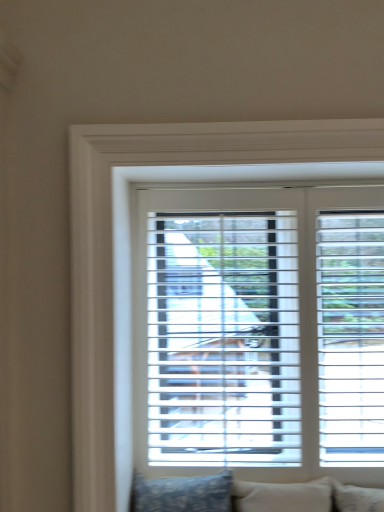
Question: Can you confirm if white plastic blinds at center is bigger than beige fabric pillow at lower center, acting as the second pillow starting from the left?

Choices:
 (A) no
 (B) yes

Answer: (B)

Question: Is beige fabric pillow at lower center, acting as the second pillow starting from the left, completely or partially inside white plastic blinds at center?

Choices:
 (A) yes
 (B) no

Answer: (B)

Question: Is white plastic blinds at center looking in the opposite direction of beige fabric pillow at lower center, which is the 1th pillow from right to left?

Choices:
 (A) yes
 (B) no

Answer: (B)

Question: Is white plastic blinds at center thinner than beige fabric pillow at lower center, which is the 1th pillow from right to left?

Choices:
 (A) no
 (B) yes

Answer: (B)

Question: From a real-world perspective, is white plastic blinds at center physically above beige fabric pillow at lower center, which is the 1th pillow from right to left?

Choices:
 (A) no
 (B) yes

Answer: (B)

Question: In the image, is white plastic blinds at center positioned in front of or behind beige fabric pillow at lower center, acting as the second pillow starting from the left?

Choices:
 (A) behind
 (B) front

Answer: (A)

Question: Considering the positions of white plastic blinds at center and beige fabric pillow at lower center, which is the 1th pillow from right to left, in the image, is white plastic blinds at center wider or thinner than beige fabric pillow at lower center, which is the 1th pillow from right to left,?

Choices:
 (A) wide
 (B) thin

Answer: (B)

Question: Is point (205, 161) closer or farther from the camera than point (311, 510)?

Choices:
 (A) farther
 (B) closer

Answer: (B)

Question: In terms of size, does white plastic blinds at center appear bigger or smaller than beige fabric pillow at lower center, which is the 1th pillow from right to left?

Choices:
 (A) small
 (B) big

Answer: (B)

Question: Considering the positions of blue patterned pillow at lower center, which ranks as the second pillow in right-to-left order, and white plastic blinds at center in the image, is blue patterned pillow at lower center, which ranks as the second pillow in right-to-left order, bigger or smaller than white plastic blinds at center?

Choices:
 (A) big
 (B) small

Answer: (B)

Question: Considering their positions, is blue patterned pillow at lower center, which ranks as the second pillow in right-to-left order, located in front of or behind white plastic blinds at center?

Choices:
 (A) behind
 (B) front

Answer: (B)

Question: From a real-world perspective, is blue patterned pillow at lower center, arranged as the 1th pillow when viewed from the left, positioned above or below white plastic blinds at center?

Choices:
 (A) above
 (B) below

Answer: (B)

Question: Does point (215, 508) appear closer or farther from the camera than point (105, 248)?

Choices:
 (A) farther
 (B) closer

Answer: (A)

Question: From a real-world perspective, is beige fabric pillow at lower center, which is the 1th pillow from right to left, above or below blue patterned pillow at lower center, which ranks as the second pillow in right-to-left order?

Choices:
 (A) below
 (B) above

Answer: (A)

Question: Considering the positions of beige fabric pillow at lower center, acting as the second pillow starting from the left, and blue patterned pillow at lower center, arranged as the 1th pillow when viewed from the left, in the image, is beige fabric pillow at lower center, acting as the second pillow starting from the left, wider or thinner than blue patterned pillow at lower center, arranged as the 1th pillow when viewed from the left,?

Choices:
 (A) thin
 (B) wide

Answer: (A)